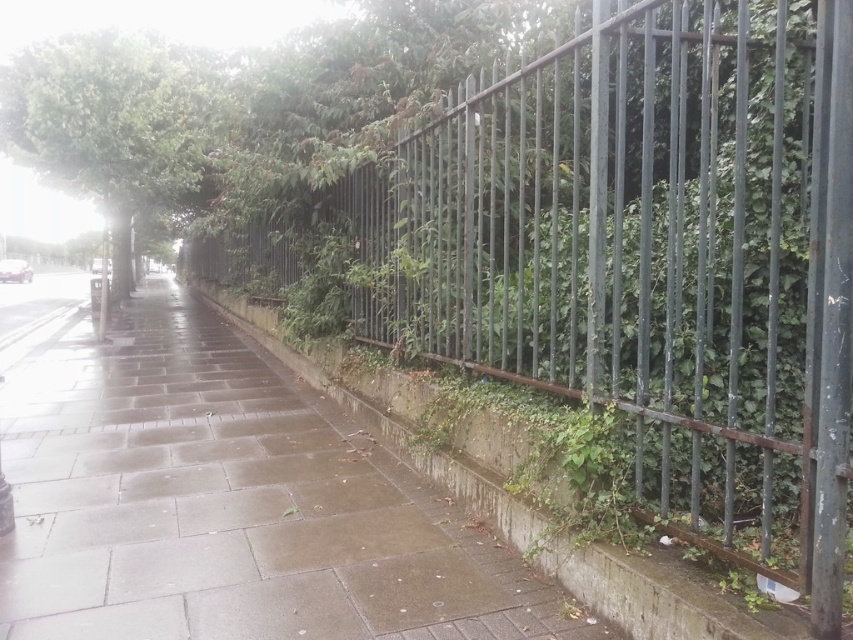
Between gray concrete pavement at center and green leafy tree at upper left, which one is positioned lower?

gray concrete pavement at center

Who is more forward, (x=277, y=630) or (x=129, y=99)?

Point (x=277, y=630) is in front.

I want to click on gray concrete pavement at center, so click(230, 502).